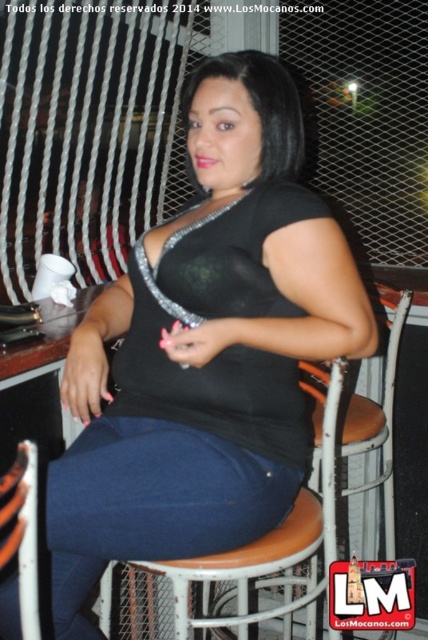
You are a photographer setting up a shoot at the bar. You have a black matte dress at center and an orange cushioned stool at center in your scene. Which object is positioned closer to your camera lens?

The black matte dress at center is closer to the viewer than the orange cushioned stool at center, so the black matte dress at center would be closer to the camera lens.

You are a guest at this bar and want to sit down. There are two seats available, the orange cushioned stool at center and the brown leather chair at lower left. Which seat is located to the right of the other?

The orange cushioned stool at center is positioned on the right side of brown leather chair at lower left, so the orange cushioned stool at center is to the right of the brown leather chair at lower left.

You are standing in front of the bar counter and want to place a small object on the surface. There are two points marked on the counter at coordinates point (252, 266) and point (18, 460). Which point is closer to you when looking directly at the counter?

Point (252, 266) is further to the viewer than point (18, 460), so the point closer to you would be point (18, 460).